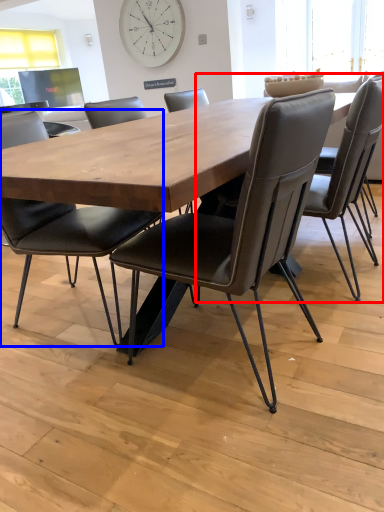
Question: Which point is closer to the camera, chair (highlighted by a red box) or chair (highlighted by a blue box)?

Choices:
 (A) chair
 (B) chair

Answer: (B)